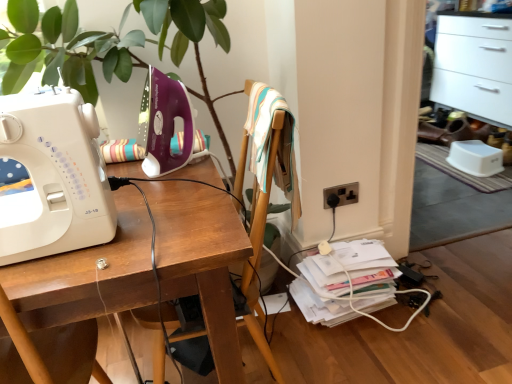
The image size is (512, 384). Identify the location of free space between white plastic sewing machine at left, the 2th sewing machine viewed from the back, and purple plastic sewing machine at upper left, the 1th sewing machine when ordered from back to front. (150, 187).